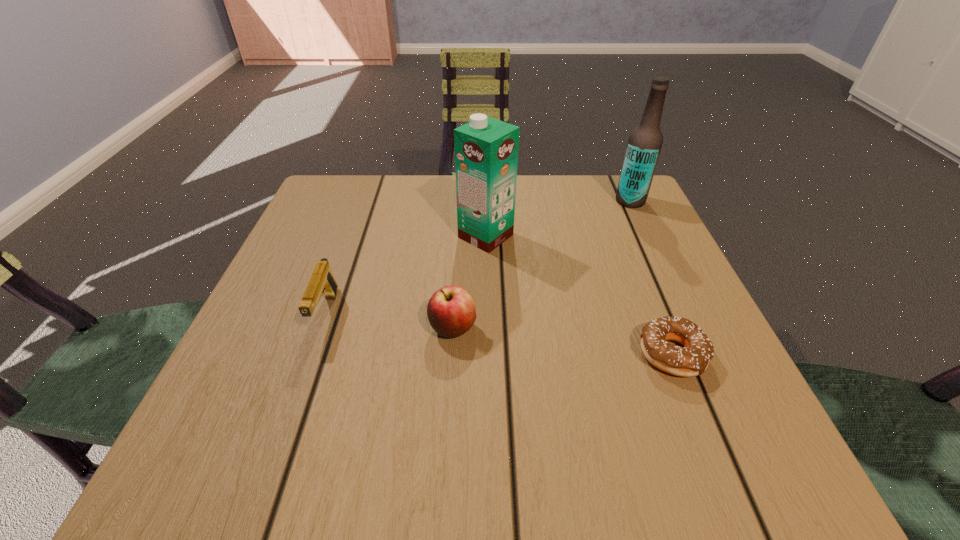
This screenshot has width=960, height=540. What are the coordinates of `vacant region between the doughnut and the carton` in the screenshot? It's located at (579, 295).

I want to click on vacant space in between the farthest object and the fourth nearest object, so click(558, 219).

Image resolution: width=960 pixels, height=540 pixels. In order to click on free space between the pistol and the beer bottle in this screenshot , I will do `click(478, 257)`.

Where is `free space between the carton and the pistol`? free space between the carton and the pistol is located at coordinates (406, 275).

The height and width of the screenshot is (540, 960). Identify the location of free spot between the apple and the beer bottle. (541, 265).

The image size is (960, 540). In order to click on the third closest object to the beer bottle in this screenshot , I will do `click(451, 311)`.

Identify the location of object that is the second closest one to the shortest object. (486, 150).

Locate an element on the screen. Image resolution: width=960 pixels, height=540 pixels. vacant area that satisfies the following two spatial constraints: 1. at the barrel of the leftmost object; 2. on the right side of the apple is located at coordinates (321, 328).

This screenshot has width=960, height=540. What are the coordinates of `free space that satisfies the following two spatial constraints: 1. on the side of the beer bottle with the label; 2. on the front side of the shortest object` in the screenshot? It's located at (702, 354).

You are a GUI agent. You are given a task and a screenshot of the screen. Output one action in this format:
    pyautogui.click(x=<x>, y=<y>)
    Task: Click on the free space that satisfies the following two spatial constraints: 1. on the front side of the second farthest object; 2. on the right side of the shortest object
    The height and width of the screenshot is (540, 960).
    Given the screenshot: What is the action you would take?
    pyautogui.click(x=488, y=354)